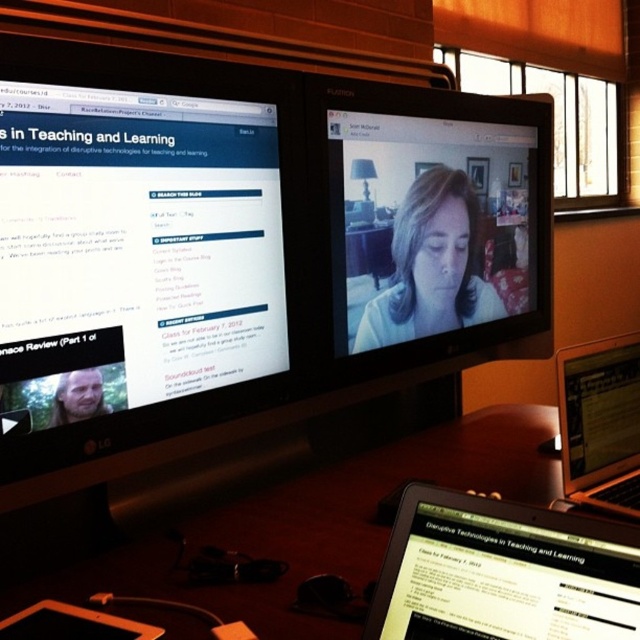
Question: Considering the relative positions of wooden desk at center and matte white face at center in the image provided, where is wooden desk at center located with respect to matte white face at center?

Choices:
 (A) right
 (B) left

Answer: (B)

Question: Estimate the real-world distances between objects in this image. Which object is farther from the black glossy monitor at upper center?

Choices:
 (A) matte white face at center
 (B) wooden desk at center
 (C) matte black tablet at lower right
 (D) black glossy laptop at lower right

Answer: (C)

Question: Which object is positioned closest to the matte black tablet at lower right?

Choices:
 (A) matte white face at center
 (B) wooden desk at center
 (C) black glossy monitor at upper center
 (D) black glossy laptop at lower right

Answer: (B)

Question: Does matte black tablet at lower right have a lesser width compared to matte white face at center?

Choices:
 (A) yes
 (B) no

Answer: (A)

Question: Does matte black tablet at lower right have a larger size compared to black glossy laptop at lower right?

Choices:
 (A) yes
 (B) no

Answer: (B)

Question: Which of the following is the farthest from the observer?

Choices:
 (A) (369, 499)
 (B) (115, 460)
 (C) (560, 433)

Answer: (C)